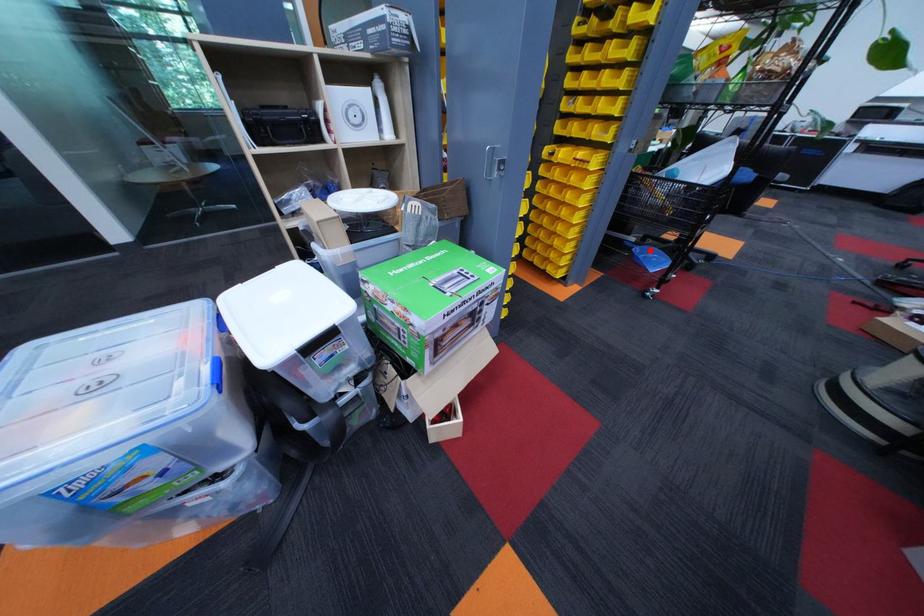
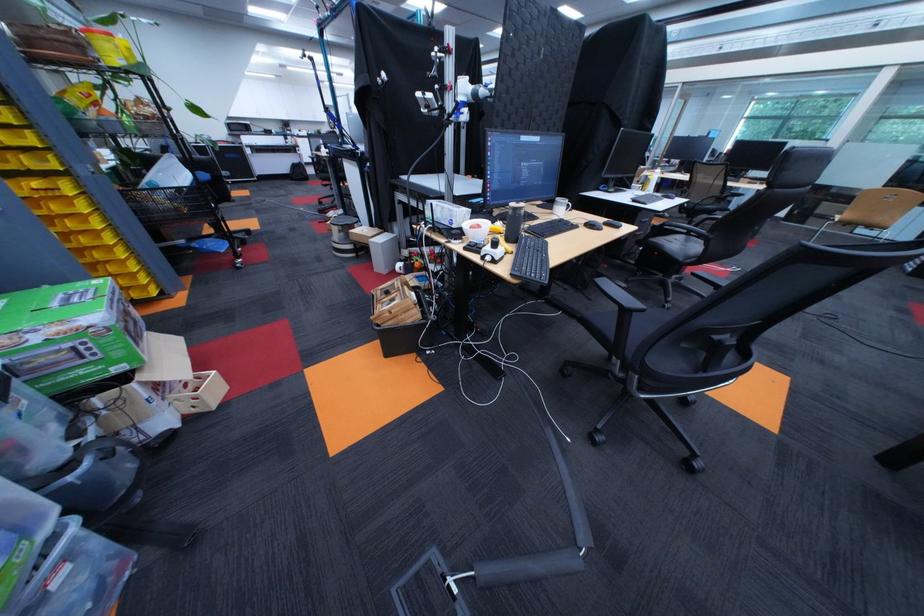
Locate, in the second image, the point that corresponds to the highlighted location in the first image.

(209, 246)